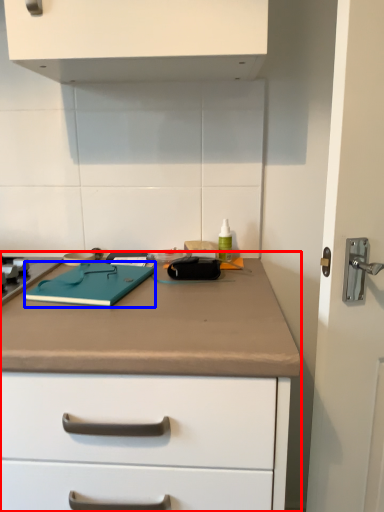
Question: Which of the following is the closest to the observer, counter (highlighted by a red box) or notebook (highlighted by a blue box)?

Choices:
 (A) counter
 (B) notebook

Answer: (A)